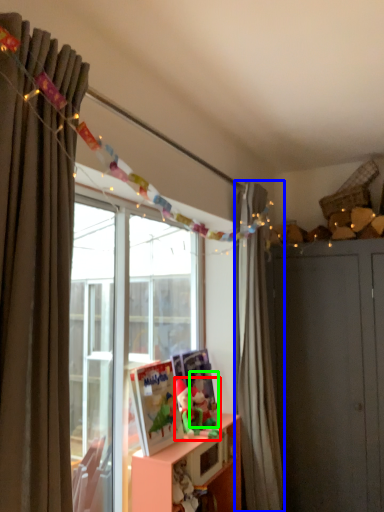
Question: Considering the real-world distances, which object is closest to toy (highlighted by a red box)? curtain (highlighted by a blue box) or toy (highlighted by a green box).

Choices:
 (A) curtain
 (B) toy

Answer: (B)